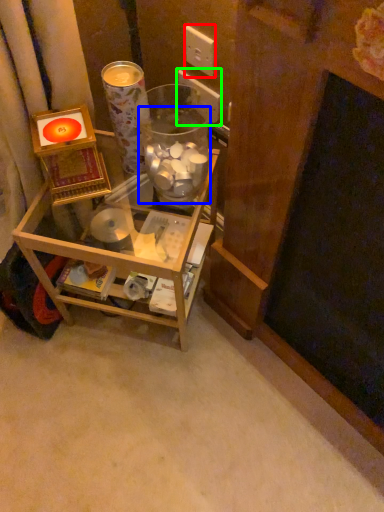
Question: Estimate the real-world distances between objects in this image. Which object is farther from electric outlet (highlighted by a red box), glass jar (highlighted by a blue box) or electric outlet (highlighted by a green box)?

Choices:
 (A) glass jar
 (B) electric outlet

Answer: (A)